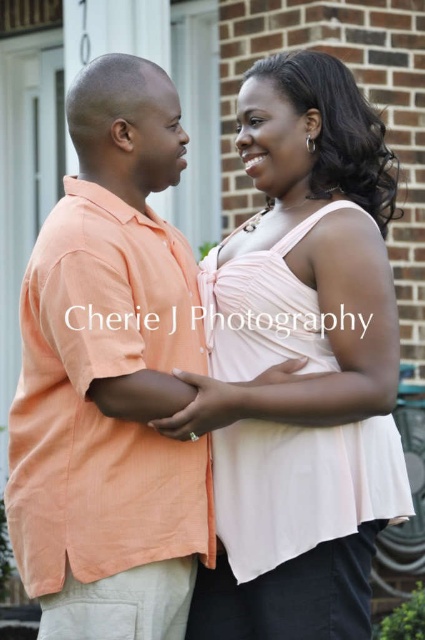
Question: Is the position of matte pink dress at center more distant than that of orange linen shirt at left?

Choices:
 (A) no
 (B) yes

Answer: (B)

Question: Which of the following is the farthest from the observer?

Choices:
 (A) [19, 499]
 (B) [340, 301]

Answer: (A)

Question: Which object is closer to the camera taking this photo?

Choices:
 (A) orange linen shirt at left
 (B) matte pink dress at center

Answer: (A)

Question: Can you confirm if matte pink dress at center is smaller than orange linen shirt at left?

Choices:
 (A) yes
 (B) no

Answer: (B)

Question: Which point is farther from the camera taking this photo?

Choices:
 (A) (167, 134)
 (B) (212, 326)

Answer: (B)

Question: Is matte pink dress at center behind orange linen shirt at left?

Choices:
 (A) yes
 (B) no

Answer: (A)